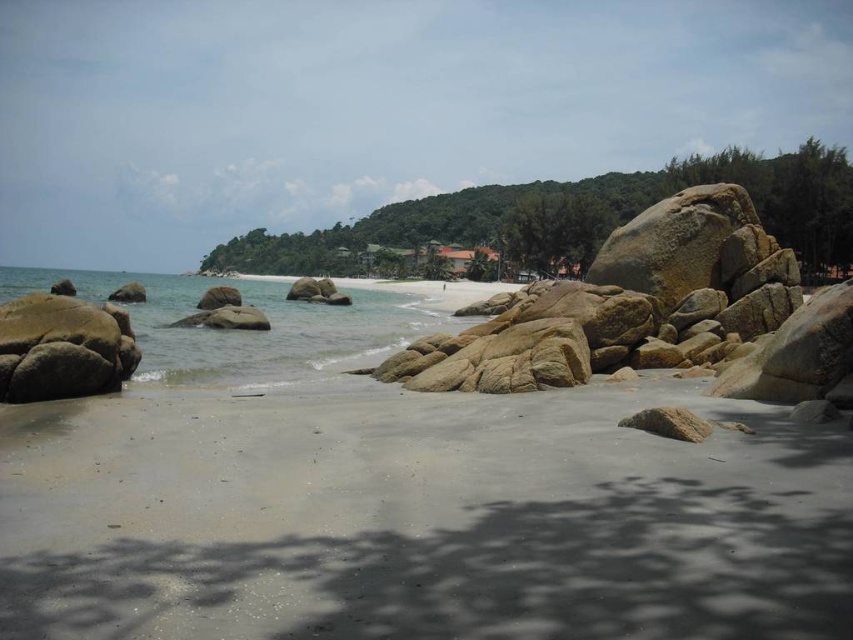
You are planning to build a sandcastle on the beach. You have two options for the foundation material. One is the smooth granite rocks at center, and the other is the smooth sand at lower left. Which material would provide a wider base for the foundation?

The smooth sand at lower left is wider than the smooth granite rocks at center, so it would provide a wider base for the foundation.